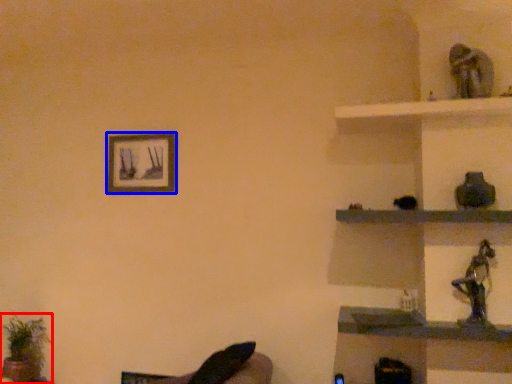
Question: Which object is further to the camera taking this photo, houseplant (highlighted by a red box) or picture frame (highlighted by a blue box)?

Choices:
 (A) houseplant
 (B) picture frame

Answer: (B)